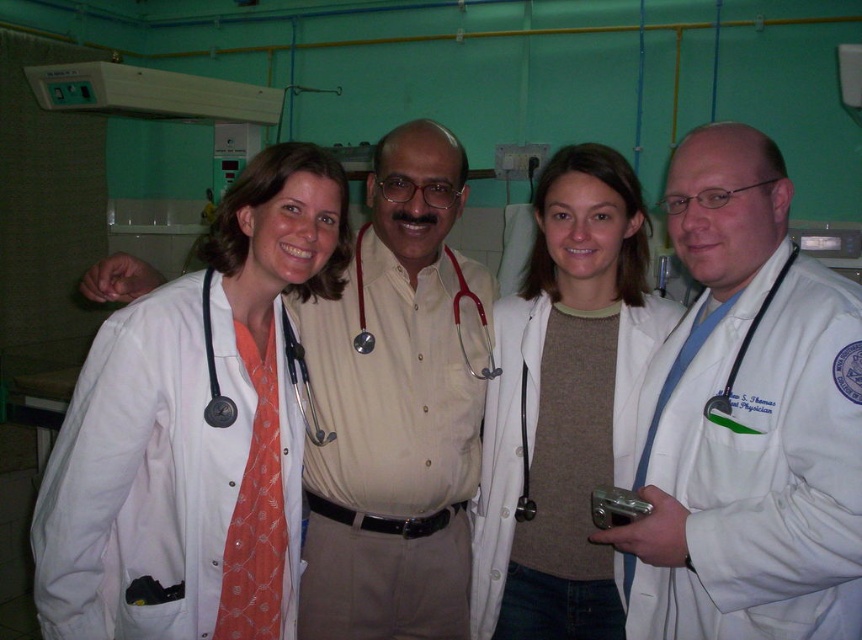
Consider the image. You are a medical student observing the group of four individuals in the hospital scene. You notice two stethoscopes at the center of the image. Which stethoscope, the matte black stethoscope at center or the matte red stethoscope at center, is positioned lower?

The matte black stethoscope at center is located below the matte red stethoscope at center, so the matte black stethoscope at center is positioned lower.

You are a medical student standing in the hospital scene described. You need to reach both the point at coordinates point (286, 333) and point (361, 349). Which point should you approach first to minimize the total distance walked?

→ You should approach point (286, 333) first because it is closer to you than point (361, 349), so reaching it first would reduce the overall distance walked.